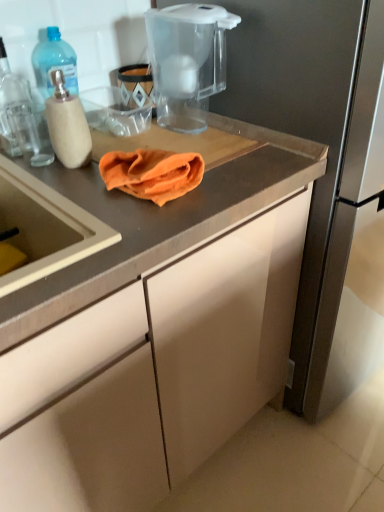
I want to click on free space in front of translucent plastic bottle at left, so click(x=32, y=172).